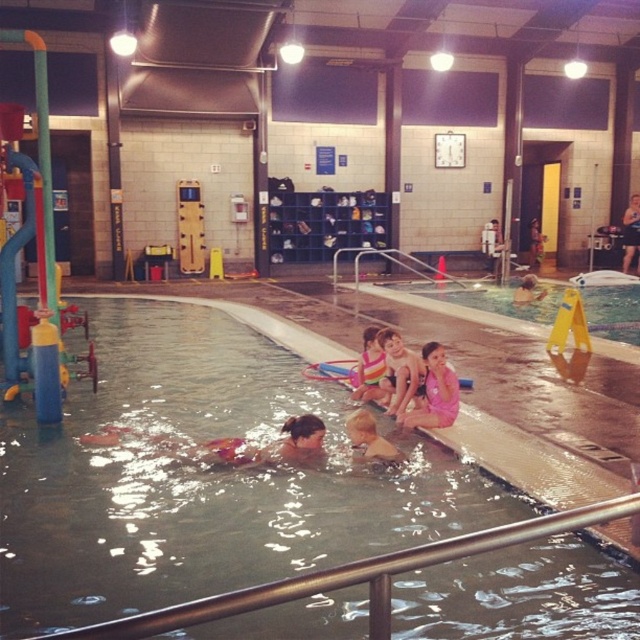
You are a lifeguard at the pool and need to determine which swimmer is closer to the shallow end. The striped fabric swimsuit at center and the smooth blue swimmer at upper right are in your line of sight. Which swimmer is closer to the shallow end?

The striped fabric swimsuit at center is closer to the shallow end because it is positioned at the center of the pool, which is closer to the shallow end compared to the smooth blue swimmer at upper right who is further away.

You are a lifeguard observing the pool area. You notice two people in the water. One has light brown skin at center and the other is a smooth blue swimmer at upper right. Which of these two has a wider body?

The smooth blue swimmer at upper right has a wider body than the light brown skin at center.

You are a lifeguard standing at the edge of the pool. You see the striped fabric swimsuit at center and the smooth blue swimmer at upper right. Which one is closer to the bottom of the pool?

The striped fabric swimsuit at center is below the smooth blue swimmer at upper right, so it is closer to the bottom of the pool.